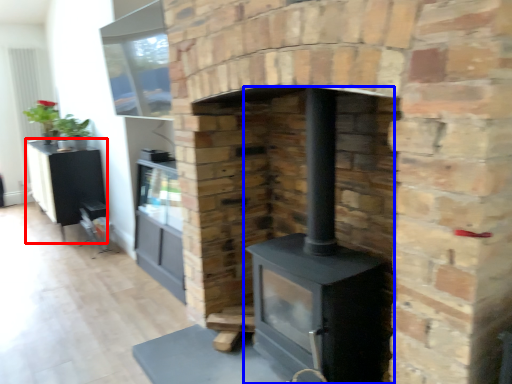
Question: Which object is closer to the camera taking this photo, entertainment center (highlighted by a red box) or wood burning stove (highlighted by a blue box)?

Choices:
 (A) entertainment center
 (B) wood burning stove

Answer: (B)